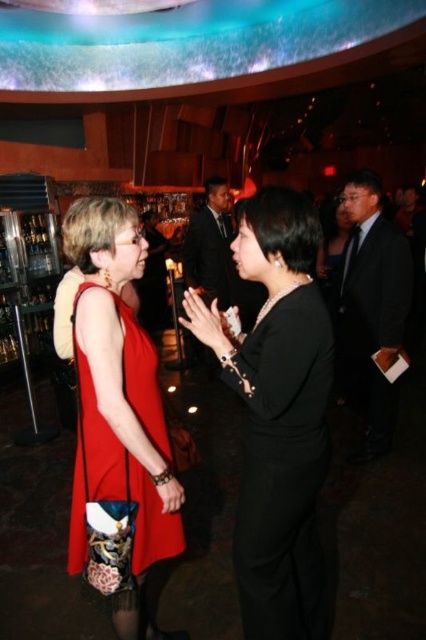
Question: Among these points, which one is nearest to the camera?

Choices:
 (A) (362, 352)
 (B) (127, 484)

Answer: (B)

Question: Does black satin dress at center lie in front of dark suit at right?

Choices:
 (A) no
 (B) yes

Answer: (B)

Question: Observing the image, what is the correct spatial positioning of matte red dress at center in reference to dark suit at right?

Choices:
 (A) left
 (B) right

Answer: (A)

Question: Which object is the farthest from the matte red dress at center?

Choices:
 (A) black satin dress at center
 (B) dark suit at right

Answer: (B)

Question: Which point is closer to the camera?

Choices:
 (A) (256, 552)
 (B) (388, 406)

Answer: (A)

Question: Is the position of black satin dress at center more distant than that of matte red dress at center?

Choices:
 (A) yes
 (B) no

Answer: (B)